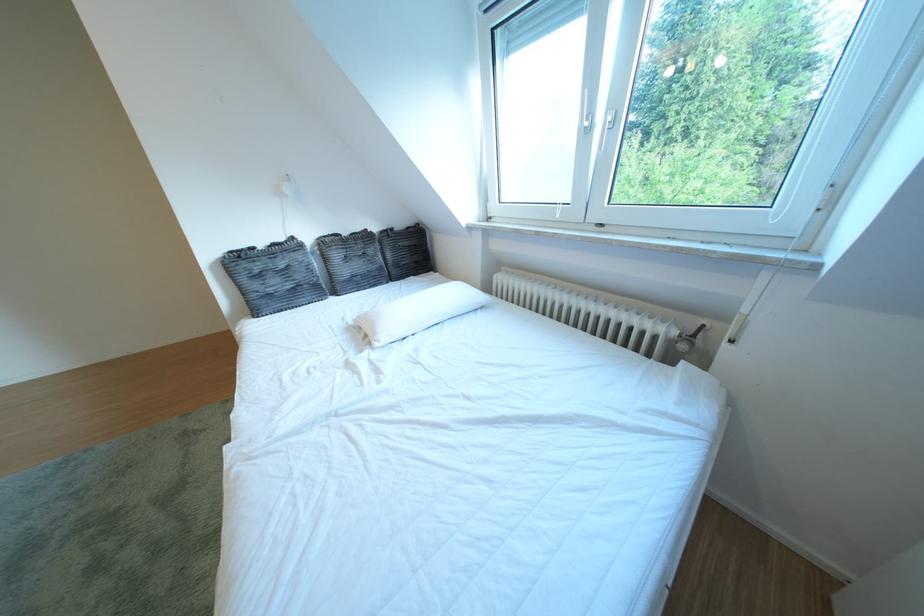
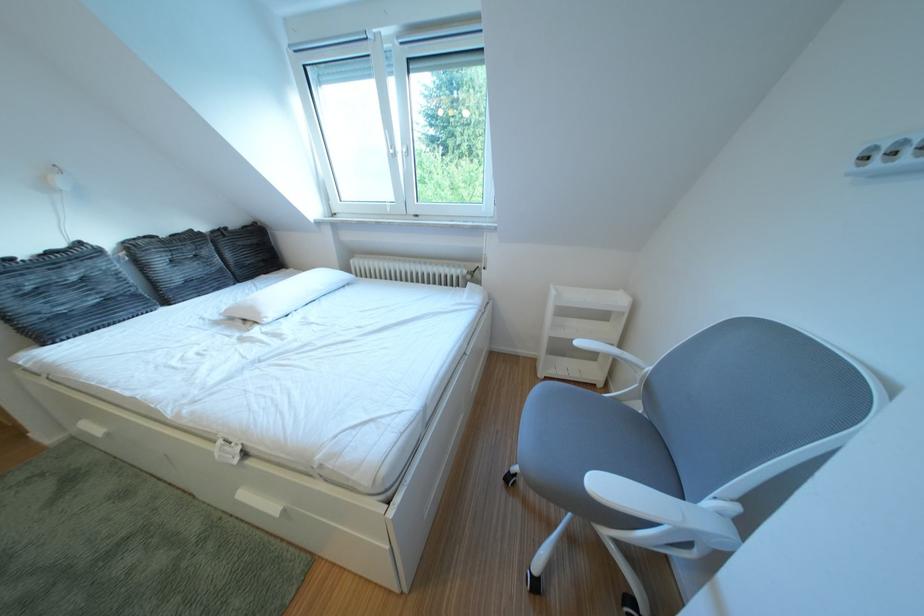
The point at (359, 238) is marked in the first image. Where is the corresponding point in the second image?

(176, 240)